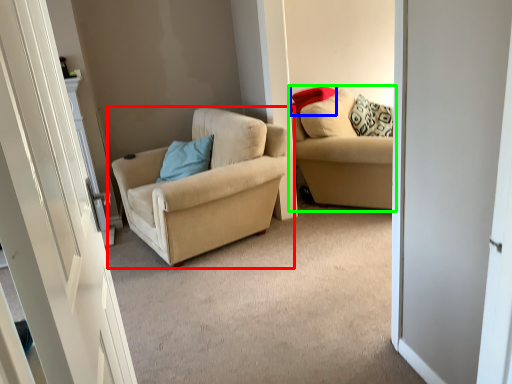
Question: Based on their relative distances, which object is nearer to chair (highlighted by a red box)? Choose from pillow (highlighted by a blue box) and studio couch (highlighted by a green box).

Choices:
 (A) pillow
 (B) studio couch

Answer: (B)